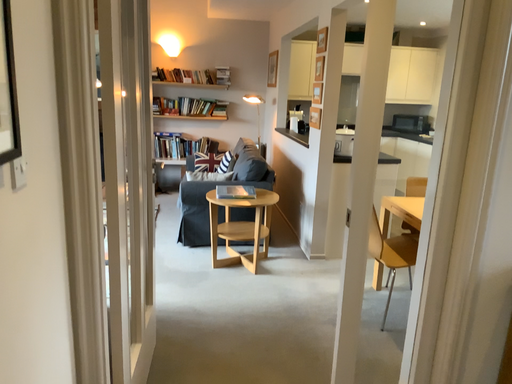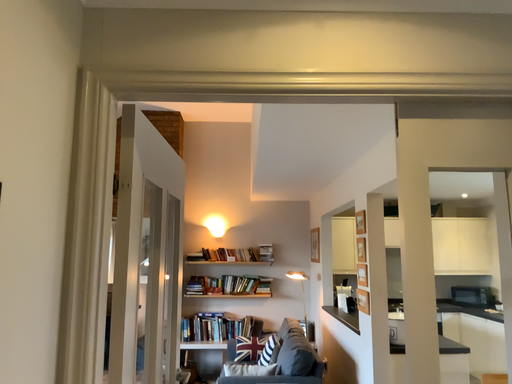
Question: How did the camera likely rotate when shooting the video?

Choices:
 (A) rotated downward
 (B) rotated upward

Answer: (B)